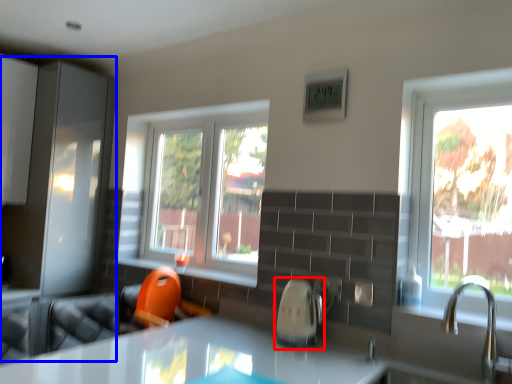
Question: Which object is further to the camera taking this photo, appliance (highlighted by a red box) or screen door (highlighted by a blue box)?

Choices:
 (A) appliance
 (B) screen door

Answer: (B)